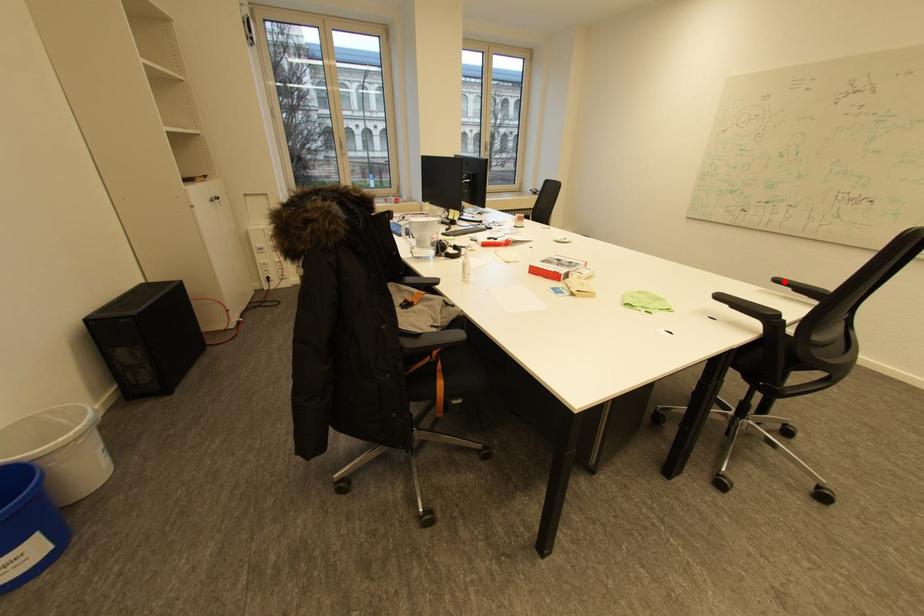
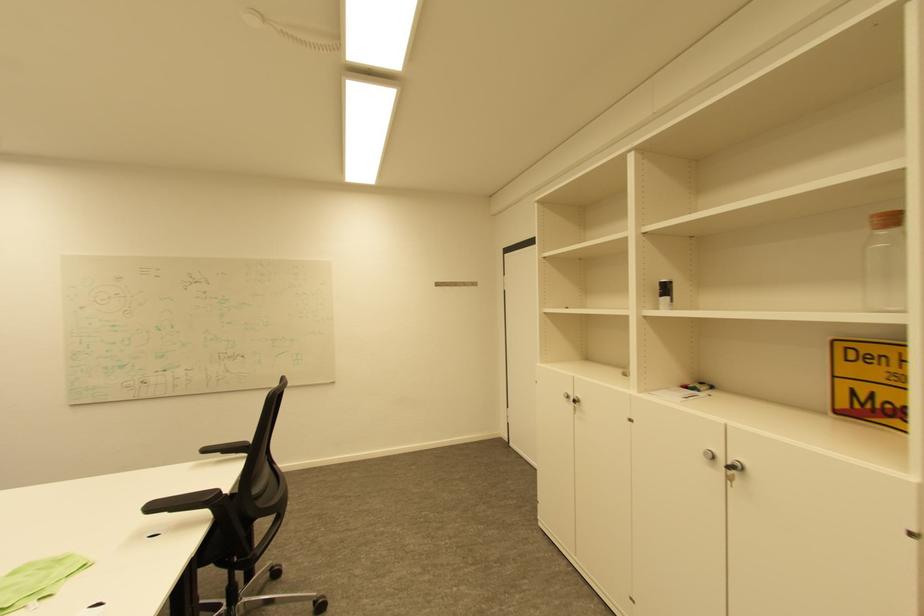
Find the pixel in the second image that matches the highlighted location in the first image.

(213, 450)